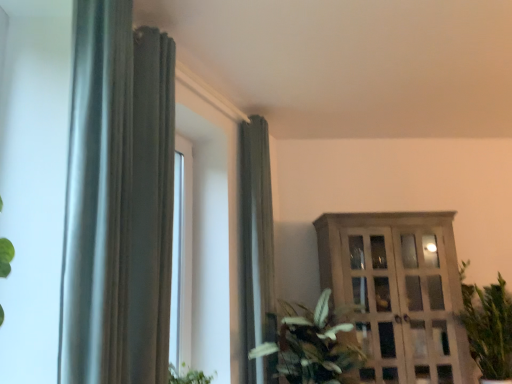
Question: From a real-world perspective, relative to wooden cabinet at right, is green leafy plant at center, which is counted as the 2th houseplant, starting from the right, vertically above or below?

Choices:
 (A) below
 (B) above

Answer: (A)

Question: Is green leafy plant at center, the 1th houseplant in the left-to-right sequence, bigger or smaller than wooden cabinet at right?

Choices:
 (A) big
 (B) small

Answer: (B)

Question: Which object is positioned farthest from the satin gray curtain at center, the 2th curtain viewed from the front?

Choices:
 (A) wooden cabinet at right
 (B) green leafy plant at center, which is counted as the 2th houseplant, starting from the right
 (C) green leafy plant at right, marked as the second houseplant in a left-to-right arrangement
 (D) satin silver curtain at left, which is counted as the first curtain, starting from the left

Answer: (C)

Question: Which is nearer to the satin silver curtain at left, which is counted as the first curtain, starting from the left?

Choices:
 (A) green leafy plant at right, marked as the 1th houseplant in a right-to-left arrangement
 (B) wooden cabinet at right
 (C) satin gray curtain at center, the 2th curtain from the left
 (D) green leafy plant at center, which is counted as the 2th houseplant, starting from the right

Answer: (C)